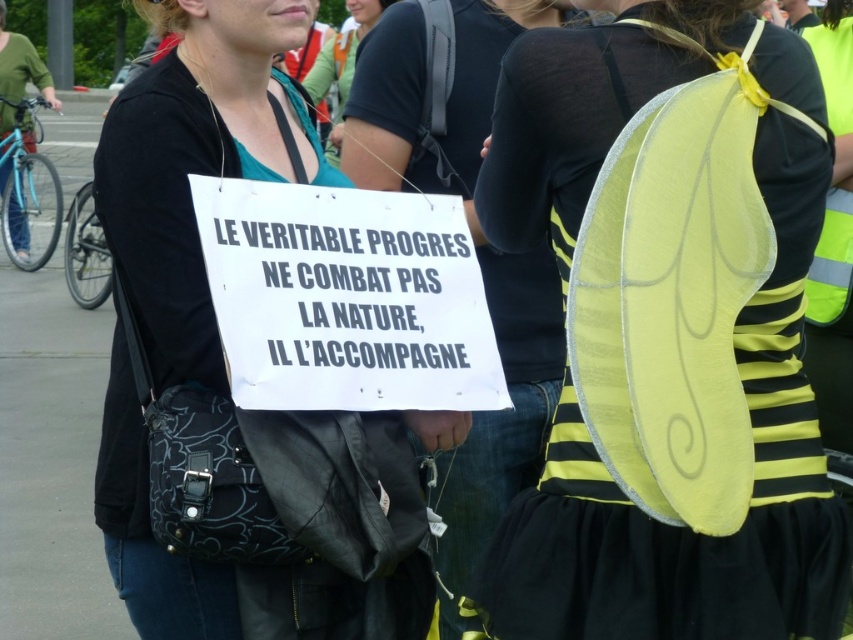
Is yellow fabric wings at center closer to the viewer compared to yellow fabric wings at upper right?

Yes, yellow fabric wings at center is closer to the viewer.

Measure the distance between yellow fabric wings at center and camera.

yellow fabric wings at center and camera are 8.31 feet apart from each other.

Does point (560, 600) come farther from viewer compared to point (465, 211)?

No, it is not.

Locate an element on the screen. yellow fabric wings at center is located at coordinates (544, 138).

Image resolution: width=853 pixels, height=640 pixels. I want to click on yellow fabric wings at center, so pyautogui.click(x=544, y=138).

Identify the location of yellow fabric wings at center. The width and height of the screenshot is (853, 640). (544, 138).

Locate an element on the screen. yellow fabric wings at center is located at coordinates (544, 138).

Does white paper sign at center appear on the right side of matte black shirt at upper center?

Yes, white paper sign at center is to the right of matte black shirt at upper center.

The image size is (853, 640). What do you see at coordinates (241, 64) in the screenshot?
I see `white paper sign at center` at bounding box center [241, 64].

Describe the element at coordinates (241, 64) in the screenshot. This screenshot has height=640, width=853. I see `white paper sign at center` at that location.

You are a GUI agent. You are given a task and a screenshot of the screen. Output one action in this format:
    pyautogui.click(x=<x>, y=<y>)
    Task: Click on the white paper sign at center
    
    Given the screenshot: What is the action you would take?
    pyautogui.click(x=241, y=64)